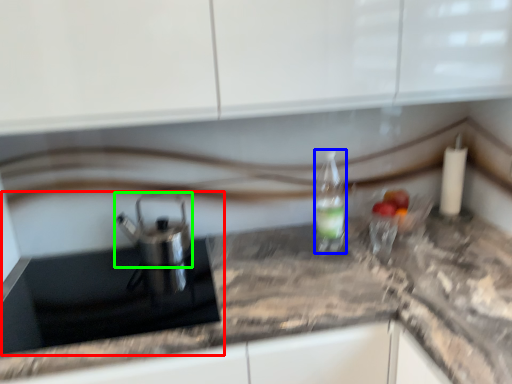
Question: Considering the real-world distances, which object is farthest from sink (highlighted by a red box)? bottle (highlighted by a blue box) or tea pot (highlighted by a green box)?

Choices:
 (A) bottle
 (B) tea pot

Answer: (A)